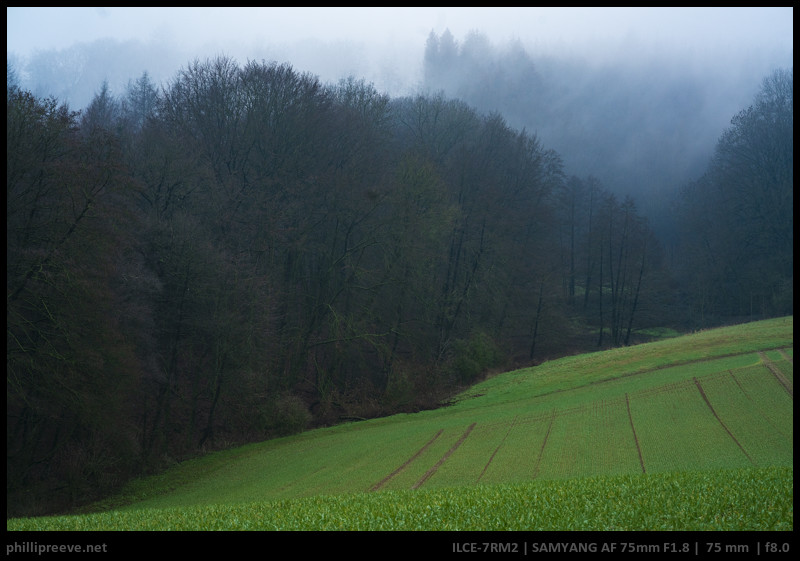
This screenshot has width=800, height=561. Identify the location of black frame around the photo. (4, 163), (309, 547), (398, 6), (797, 285).